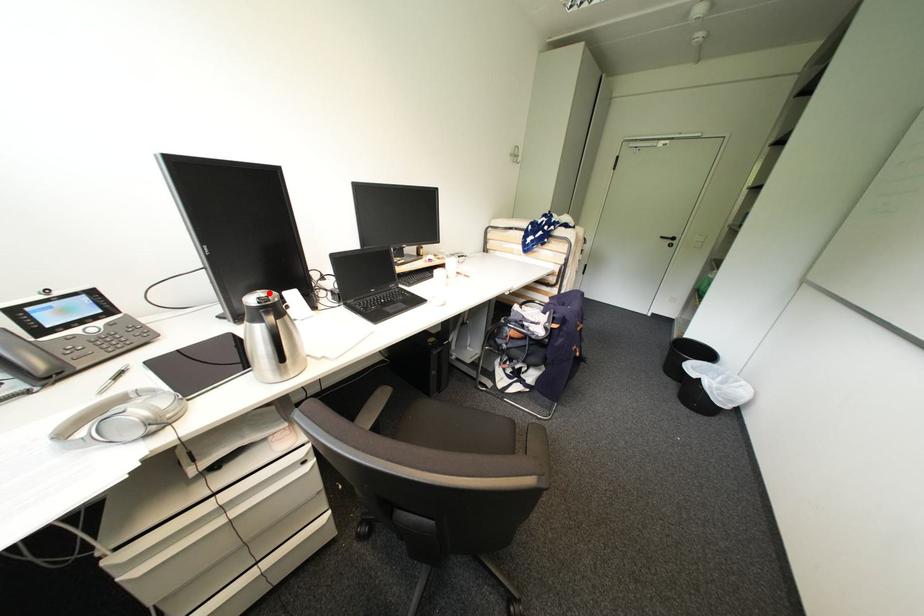
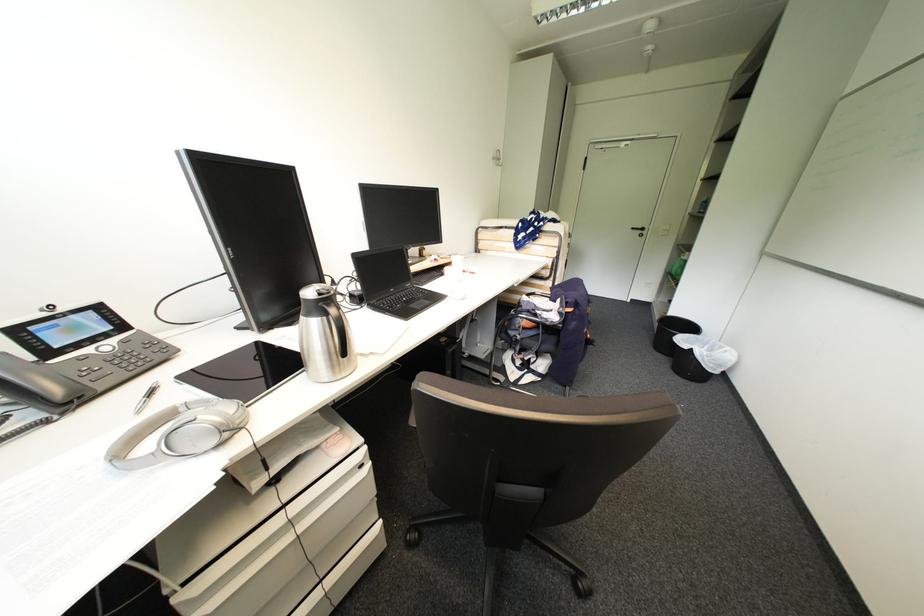
Find the pixel in the second image that matches the highlighted location in the first image.

(324, 286)